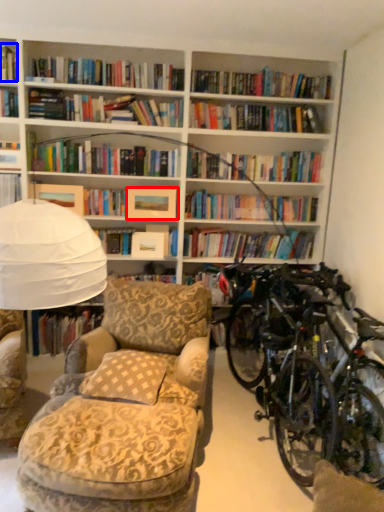
Question: Which point is closer to the camera, paperback book (highlighted by a red box) or book (highlighted by a blue box)?

Choices:
 (A) paperback book
 (B) book

Answer: (B)